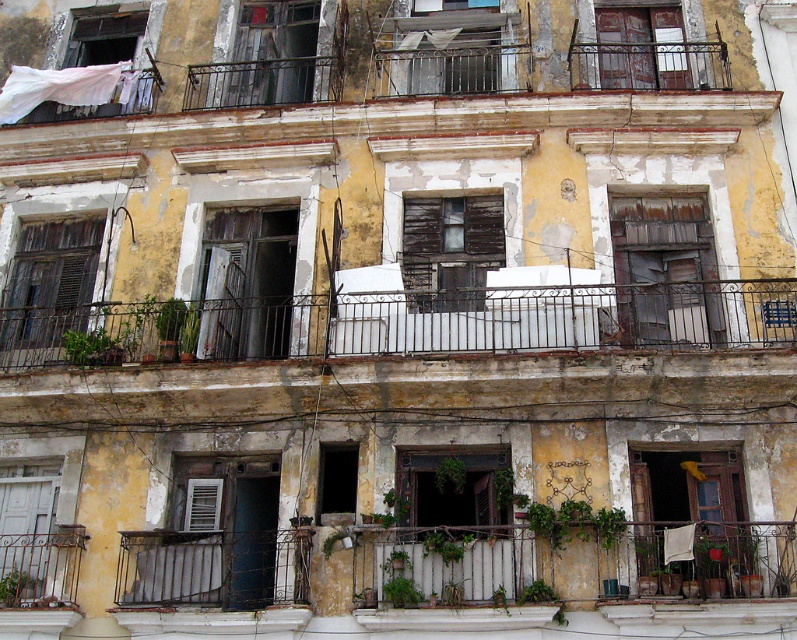
You are standing in front of the building and want to enter through one of the windows. The rusty metal window at upper center is blocked by debris, but the wooden shuttered window at center is accessible. Which window should you choose to enter?

You should choose the wooden shuttered window at center because it is accessible and located behind the rusty metal window at upper center, meaning it might be on a lower floor or closer to the ground, making entry easier.

You are standing in front of the building and notice two windows. One is the rusty metal window at upper center and the other is the wooden shuttered window at center. Which one is positioned to the left when viewed from the front?

The rusty metal window at upper center is to the left of the wooden shuttered window at center.

From the picture: You are standing in front of the building and want to locate the point at coordinates point (403,323). Based on the scene description, where would this point be located?

The point (403,323) is located on the rusty metal balcony at center.